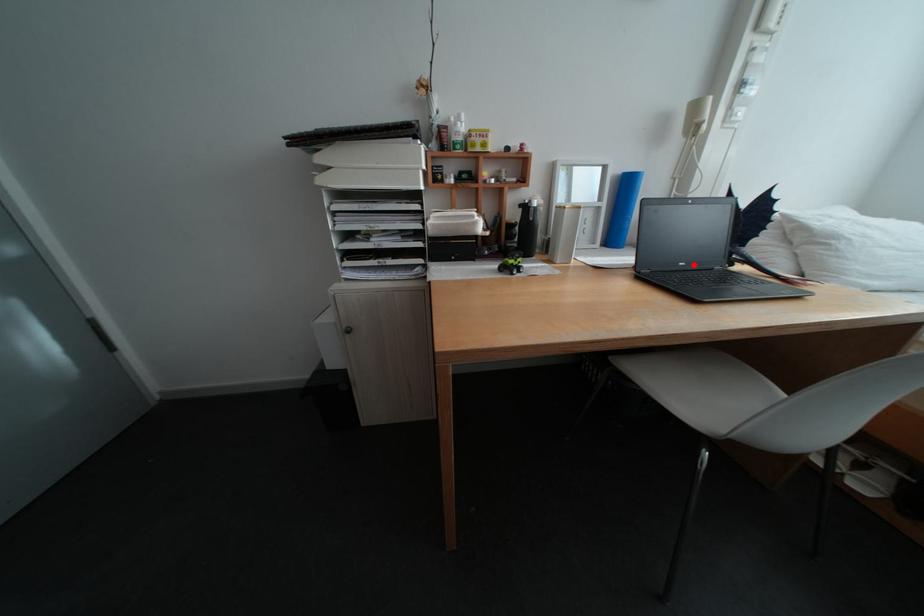
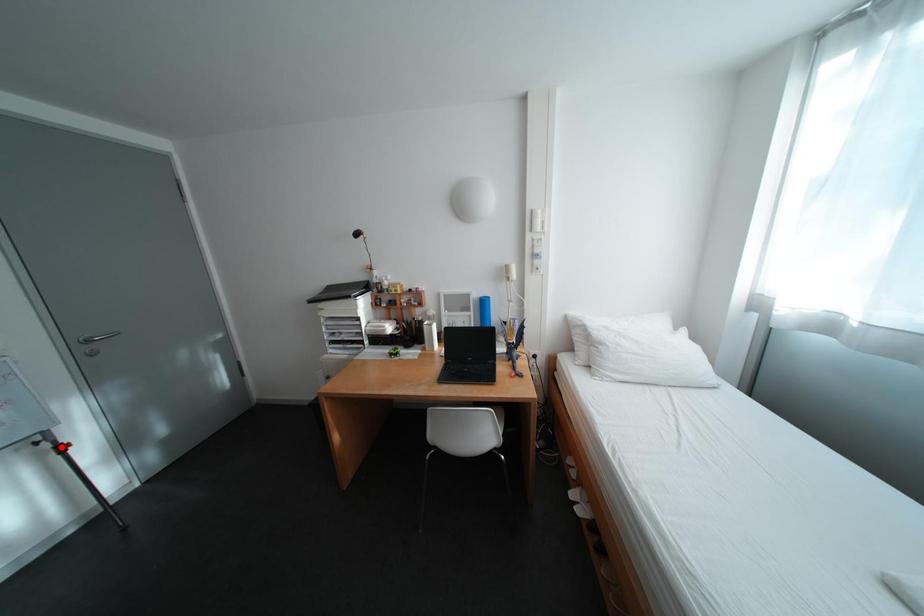
I am providing you with two images of the same scene from different viewpoints. A red point is marked on the first image and another point is marked on the second image. Does the point marked in image1 correspond to the same location as the one in image2?

No